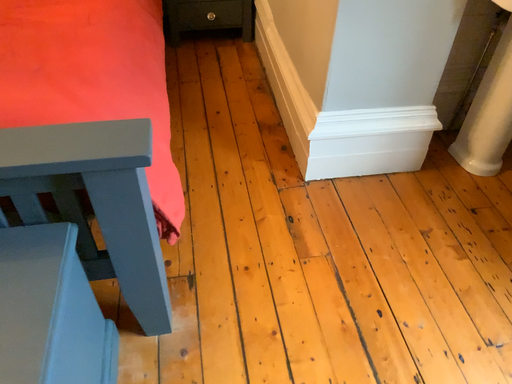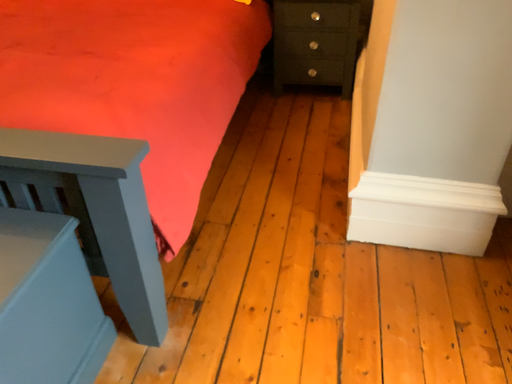
Question: How did the camera likely rotate when shooting the video?

Choices:
 (A) rotated upward
 (B) rotated downward

Answer: (A)